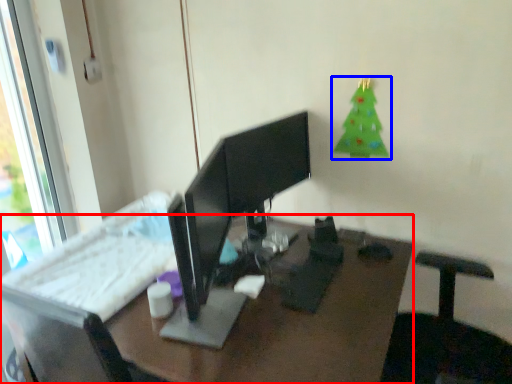
Question: Which point is further to the camera, desk (highlighted by a red box) or christmas tree (highlighted by a blue box)?

Choices:
 (A) desk
 (B) christmas tree

Answer: (B)